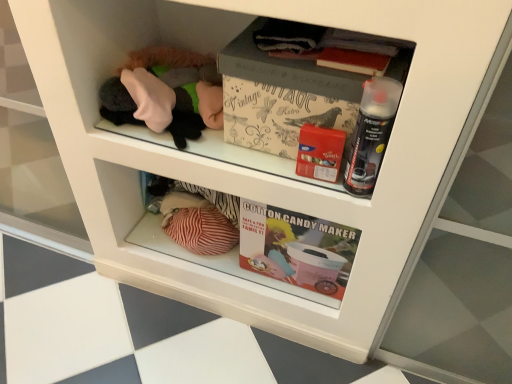
This screenshot has width=512, height=384. Describe the element at coordinates (282, 97) in the screenshot. I see `white matte cardboard box at upper center` at that location.

This screenshot has height=384, width=512. Find the location of `white matte cardboard box at upper center`. white matte cardboard box at upper center is located at coordinates (282, 97).

In order to face white matte cardboard box at upper center, should I rotate leftwards or rightwards?

A 11.362 degree turn to the right will do.

What is the approximate width of white matte cardboard box at upper center?

white matte cardboard box at upper center is 93.39 centimeters in width.

At what (x,y) coordinates should I click in order to perform the action: click on white matte cardboard box at upper center. Please return your answer as a coordinate pair (x, y). The height and width of the screenshot is (384, 512). Looking at the image, I should click on (282, 97).